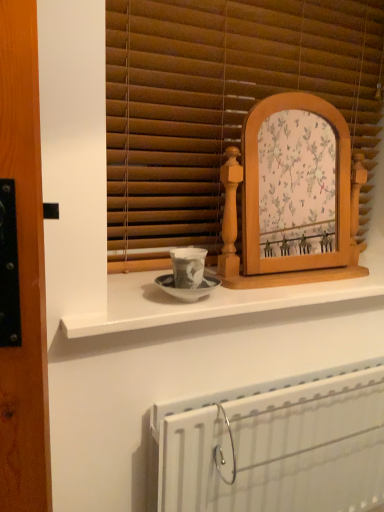
Question: Considering the relative sizes of white glossy counter at center and wooden blinds at center in the image provided, is white glossy counter at center bigger than wooden blinds at center?

Choices:
 (A) yes
 (B) no

Answer: (B)

Question: Is white glossy counter at center taller than wooden blinds at center?

Choices:
 (A) no
 (B) yes

Answer: (A)

Question: Could wooden blinds at center be considered to be inside white glossy counter at center?

Choices:
 (A) yes
 (B) no

Answer: (B)

Question: Is white glossy counter at center turned away from wooden blinds at center?

Choices:
 (A) no
 (B) yes

Answer: (A)

Question: Does white glossy counter at center lie in front of wooden blinds at center?

Choices:
 (A) no
 (B) yes

Answer: (B)

Question: From the image's perspective, is white metallic radiator at lower center above or below wooden picture frame at center?

Choices:
 (A) above
 (B) below

Answer: (B)

Question: In terms of height, does white metallic radiator at lower center look taller or shorter compared to wooden picture frame at center?

Choices:
 (A) short
 (B) tall

Answer: (B)

Question: Would you say white metallic radiator at lower center is inside or outside wooden picture frame at center?

Choices:
 (A) inside
 (B) outside

Answer: (B)

Question: From a real-world perspective, is white metallic radiator at lower center positioned above or below wooden picture frame at center?

Choices:
 (A) below
 (B) above

Answer: (A)

Question: Considering their positions, is white metallic radiator at lower center located in front of or behind wooden blinds at center?

Choices:
 (A) front
 (B) behind

Answer: (A)

Question: Based on their positions, is white metallic radiator at lower center located to the left or right of wooden blinds at center?

Choices:
 (A) right
 (B) left

Answer: (A)

Question: From a real-world perspective, is white metallic radiator at lower center positioned above or below wooden blinds at center?

Choices:
 (A) below
 (B) above

Answer: (A)

Question: In terms of size, does white metallic radiator at lower center appear bigger or smaller than wooden blinds at center?

Choices:
 (A) big
 (B) small

Answer: (B)

Question: From a real-world perspective, relative to wooden blinds at center, is wooden picture frame at center vertically above or below?

Choices:
 (A) above
 (B) below

Answer: (B)

Question: Considering the positions of wooden picture frame at center and wooden blinds at center in the image, is wooden picture frame at center taller or shorter than wooden blinds at center?

Choices:
 (A) tall
 (B) short

Answer: (B)